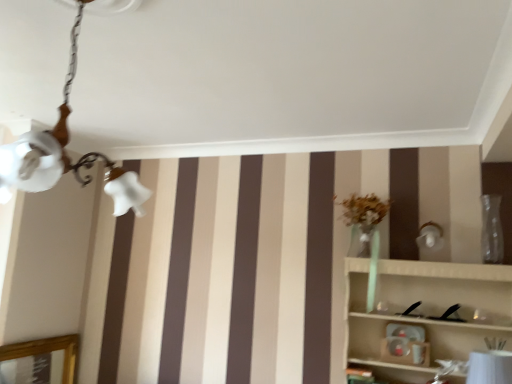
The height and width of the screenshot is (384, 512). Identify the location of white glossy table lamp at lower right. (490, 367).

What is the approximate width of white glossy table lamp at lower right?

23.74 centimeters.

The width and height of the screenshot is (512, 384). In order to click on wooden shelf at right in this screenshot , I will do `click(424, 310)`.

In the scene shown: What is the approximate height of white frosted glass chandelier at upper left?

white frosted glass chandelier at upper left is 30.03 inches in height.

Describe the element at coordinates (64, 153) in the screenshot. I see `white frosted glass chandelier at upper left` at that location.

From the picture: In order to face transparent glass vase at right, should I rotate leftwards or rightwards?

Rotate right and turn 28.888 degrees.

What do you see at coordinates (492, 230) in the screenshot? The width and height of the screenshot is (512, 384). I see `transparent glass vase at right` at bounding box center [492, 230].

The image size is (512, 384). Find the location of `white glossy table lamp at lower right`. white glossy table lamp at lower right is located at coordinates (490, 367).

From a real-world perspective, between white glossy table lamp at lower right and white frosted glass chandelier at upper left, who is vertically lower?

white glossy table lamp at lower right.

Does white glossy table lamp at lower right contain white frosted glass chandelier at upper left?

No, white frosted glass chandelier at upper left is located outside of white glossy table lamp at lower right.

Considering the sizes of objects white glossy table lamp at lower right and white frosted glass chandelier at upper left in the image provided, who is bigger, white glossy table lamp at lower right or white frosted glass chandelier at upper left?

white frosted glass chandelier at upper left.

Could you tell me if white glossy table lamp at lower right is facing white frosted glass chandelier at upper left?

No, white glossy table lamp at lower right is not aimed at white frosted glass chandelier at upper left.

How different are the orientations of white frosted glass chandelier at upper left and wooden shelf at right in degrees?

The facing directions of white frosted glass chandelier at upper left and wooden shelf at right are 5.33 degrees apart.

Between white frosted glass chandelier at upper left and wooden shelf at right, which one has larger size?

wooden shelf at right is bigger.

Which is in front, white frosted glass chandelier at upper left or wooden shelf at right?

white frosted glass chandelier at upper left is more forward.

Relative to white glossy table lamp at lower right, is transparent glass vase at right in front or behind?

transparent glass vase at right is behind white glossy table lamp at lower right.

Which of these two, transparent glass vase at right or white glossy table lamp at lower right, stands taller?

transparent glass vase at right is taller.

Can you confirm if white glossy table lamp at lower right is wider than wooden shelf at right?

No.

Is white glossy table lamp at lower right inside or outside of wooden shelf at right?

white glossy table lamp at lower right can be found inside wooden shelf at right.

Which is behind, white glossy table lamp at lower right or wooden shelf at right?

Positioned behind is white glossy table lamp at lower right.

Considering the relative sizes of white frosted glass chandelier at upper left and transparent glass vase at right in the image provided, is white frosted glass chandelier at upper left smaller than transparent glass vase at right?

Actually, white frosted glass chandelier at upper left might be larger than transparent glass vase at right.

Considering the sizes of objects white frosted glass chandelier at upper left and transparent glass vase at right in the image provided, who is thinner, white frosted glass chandelier at upper left or transparent glass vase at right?

Thinner between the two is transparent glass vase at right.

Could you measure the distance between white frosted glass chandelier at upper left and transparent glass vase at right?

white frosted glass chandelier at upper left is 6.73 feet away from transparent glass vase at right.

Is transparent glass vase at right oriented towards white frosted glass chandelier at upper left?

No.

Which is less distant, (482, 244) or (14, 178)?

Point (482, 244) is farther from the camera than point (14, 178).

Which object is wider, transparent glass vase at right or white frosted glass chandelier at upper left?

Wider between the two is white frosted glass chandelier at upper left.

Is transparent glass vase at right not within white frosted glass chandelier at upper left?

Yes.

Between point (349, 291) and point (504, 366), which one is positioned in front?

Positioned in front is point (504, 366).

From a real-world perspective, is wooden shelf at right over white glossy table lamp at lower right?

Yes, from a real-world perspective, wooden shelf at right is over white glossy table lamp at lower right

Considering the relative sizes of wooden shelf at right and white glossy table lamp at lower right in the image provided, is wooden shelf at right shorter than white glossy table lamp at lower right?

Incorrect, the height of wooden shelf at right does not fall short of that of white glossy table lamp at lower right.

Is wooden shelf at right further to the viewer compared to white glossy table lamp at lower right?

No, wooden shelf at right is closer to the viewer.

Locate an element on the screen. lamp above the white glossy table lamp at lower right (from a real-world perspective) is located at coordinates pyautogui.click(x=64, y=153).

At what (x,y) coordinates should I click in order to perform the action: click on shelf that appears below the white frosted glass chandelier at upper left (from a real-world perspective). Please return your answer as a coordinate pair (x, y). Looking at the image, I should click on (424, 310).

Looking at the image, which one is located closer to white frosted glass chandelier at upper left, wooden shelf at right or transparent glass vase at right?

The object closer to white frosted glass chandelier at upper left is wooden shelf at right.

When comparing their distances from white frosted glass chandelier at upper left, does wooden shelf at right or white glossy table lamp at lower right seem closer?

white glossy table lamp at lower right is positioned closer to the anchor white frosted glass chandelier at upper left.

From the image, which object appears to be farther from wooden shelf at right, transparent glass vase at right or white frosted glass chandelier at upper left?

white frosted glass chandelier at upper left is further to wooden shelf at right.

Based on their spatial positions, is white frosted glass chandelier at upper left or transparent glass vase at right closer to wooden shelf at right?

transparent glass vase at right is positioned closer to the anchor wooden shelf at right.

Based on their spatial positions, is transparent glass vase at right or white glossy table lamp at lower right closer to wooden shelf at right?

Based on the image, transparent glass vase at right appears to be nearer to wooden shelf at right.

Based on the photo, based on their spatial positions, is transparent glass vase at right or wooden shelf at right further from white frosted glass chandelier at upper left?

Based on the image, transparent glass vase at right appears to be further to white frosted glass chandelier at upper left.

Based on their spatial positions, is white frosted glass chandelier at upper left or wooden shelf at right further from transparent glass vase at right?

The object further to transparent glass vase at right is white frosted glass chandelier at upper left.

Estimate the real-world distances between objects in this image. Which object is further from transparent glass vase at right, white glossy table lamp at lower right or wooden shelf at right?

Among the two, white glossy table lamp at lower right is located further to transparent glass vase at right.

Where is `shelf between white frosted glass chandelier at upper left and white glossy table lamp at lower right in the horizontal direction`? This screenshot has height=384, width=512. shelf between white frosted glass chandelier at upper left and white glossy table lamp at lower right in the horizontal direction is located at coordinates [x=424, y=310].

The height and width of the screenshot is (384, 512). In order to click on shelf located between white frosted glass chandelier at upper left and transparent glass vase at right in the left-right direction in this screenshot , I will do `click(424, 310)`.

Identify the location of shelf that lies between transparent glass vase at right and white glossy table lamp at lower right from top to bottom. This screenshot has height=384, width=512. (424, 310).

Identify the location of table lamp between white frosted glass chandelier at upper left and transparent glass vase at right in the horizontal direction. This screenshot has height=384, width=512. (490, 367).